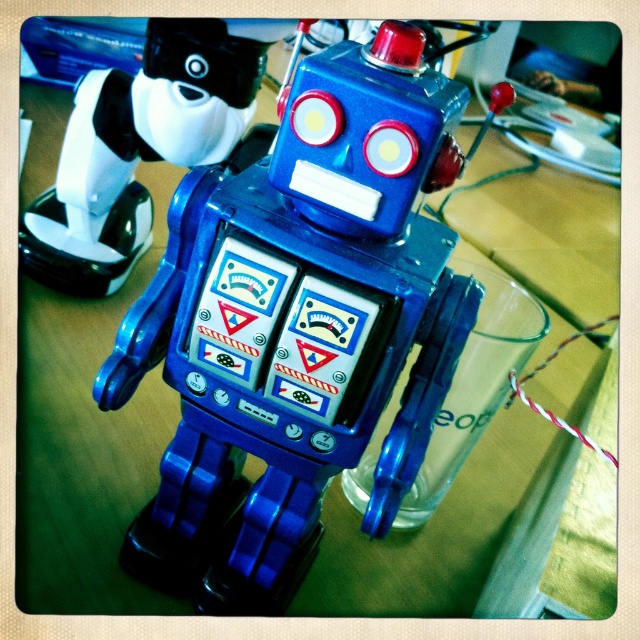
Question: Is metallic blue robot at center positioned behind blue plastic robot at center?

Choices:
 (A) yes
 (B) no

Answer: (B)

Question: Which object is closer to the camera taking this photo?

Choices:
 (A) blue plastic robot at center
 (B) metallic blue robot at center

Answer: (B)

Question: Is metallic blue robot at center below blue plastic robot at center?

Choices:
 (A) yes
 (B) no

Answer: (A)

Question: Is metallic blue robot at center below blue plastic robot at center?

Choices:
 (A) yes
 (B) no

Answer: (A)

Question: Which point appears farthest from the camera in this image?

Choices:
 (A) (252, 241)
 (B) (108, 96)

Answer: (B)